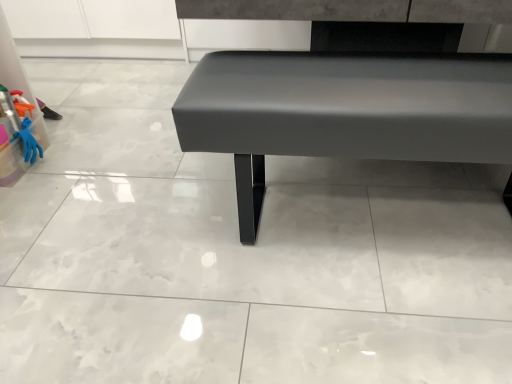
At what (x,y) coordinates should I click in order to perform the action: click on matte black bench at center. Please return your answer as a coordinate pair (x, y). Image resolution: width=512 pixels, height=384 pixels. Looking at the image, I should click on (343, 111).

The height and width of the screenshot is (384, 512). What do you see at coordinates (343, 111) in the screenshot? I see `matte black bench at center` at bounding box center [343, 111].

Locate an element on the screen. This screenshot has height=384, width=512. matte black bench at center is located at coordinates (343, 111).